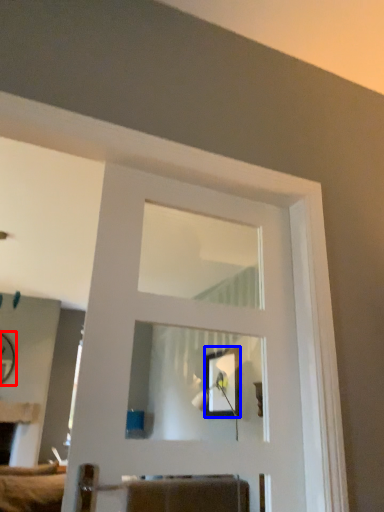
Question: Among these objects, which one is nearest to the camera, mirror (highlighted by a red box) or picture frame (highlighted by a blue box)?

Choices:
 (A) mirror
 (B) picture frame

Answer: (B)